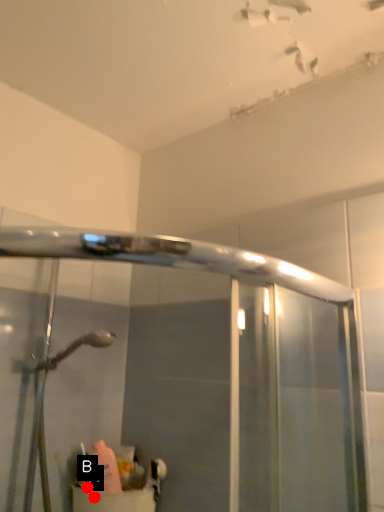
Question: Two points are circled on the image, labeled by A and B beside each circle. Among these points, which one is farthest from the camera?

Choices:
 (A) A is further
 (B) B is further

Answer: (A)